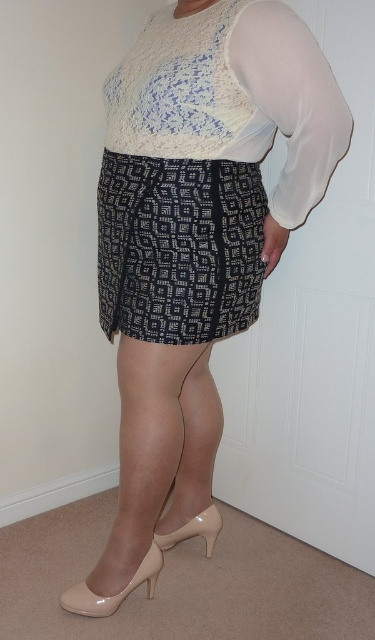
Is black printed fabric skirt at center smaller than nude patent leather high heels at lower center?

Yes, black printed fabric skirt at center is smaller than nude patent leather high heels at lower center.

Is point (214, 209) positioned before point (208, 451)?

Yes, point (214, 209) is closer to viewer.

The image size is (375, 640). Find the location of `black printed fabric skirt at center`. black printed fabric skirt at center is located at coordinates (178, 248).

Between black printed fabric skirt at center and matte beige pump at lower center, which one appears on the left side from the viewer's perspective?

Positioned to the left is black printed fabric skirt at center.

Can you confirm if black printed fabric skirt at center is positioned to the left of matte beige pump at lower center?

Indeed, black printed fabric skirt at center is positioned on the left side of matte beige pump at lower center.

What do you see at coordinates (178, 248) in the screenshot? I see `black printed fabric skirt at center` at bounding box center [178, 248].

This screenshot has height=640, width=375. I want to click on black printed fabric skirt at center, so click(x=178, y=248).

Does matte beige high-heeled shoe at lower center come behind matte beige pump at lower center?

No, matte beige high-heeled shoe at lower center is in front of matte beige pump at lower center.

Looking at this image, does matte beige high-heeled shoe at lower center appear over matte beige pump at lower center?

No, matte beige high-heeled shoe at lower center is not above matte beige pump at lower center.

I want to click on matte beige high-heeled shoe at lower center, so click(x=115, y=593).